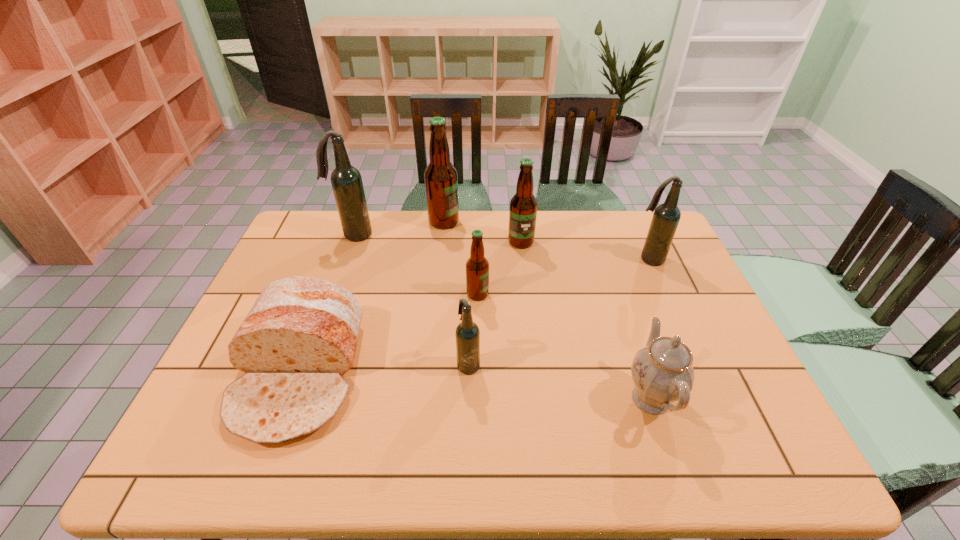
Locate an element on the screen. Image resolution: width=960 pixels, height=540 pixels. vacant space located 0.180m on the spout of the seventh object from left to right is located at coordinates (546, 399).

At what (x,y) coordinates should I click in order to perform the action: click on free space located 0.210m on the spout of the seventh object from left to right. Please return your answer as a coordinate pair (x, y). The image size is (960, 540). Looking at the image, I should click on (534, 399).

Where is `free spot located on the spout of the seventh object from left to right`? The image size is (960, 540). free spot located on the spout of the seventh object from left to right is located at coordinates (580, 399).

Image resolution: width=960 pixels, height=540 pixels. What are the coordinates of `chinaware at the near edge` in the screenshot? It's located at (662, 372).

You are a GUI agent. You are given a task and a screenshot of the screen. Output one action in this format:
    pyautogui.click(x=<x>, y=<y>)
    Task: Click on the bread present at the near edge
    The height and width of the screenshot is (540, 960).
    Given the screenshot: What is the action you would take?
    pyautogui.click(x=299, y=338)

Locate an element on the screen. beer bottle that is at the left edge is located at coordinates (346, 180).

The height and width of the screenshot is (540, 960). Identify the location of bread located at the left edge. coord(299,338).

At what (x,y) coordinates should I click in order to perform the action: click on object that is at the right edge. Please return your answer as a coordinate pair (x, y). The width and height of the screenshot is (960, 540). Looking at the image, I should click on (666, 217).

At what (x,y) coordinates should I click in order to perform the action: click on object situated at the far left corner. Please return your answer as a coordinate pair (x, y). The height and width of the screenshot is (540, 960). Looking at the image, I should click on (346, 180).

Identify the location of object that is at the near left corner. (299, 338).